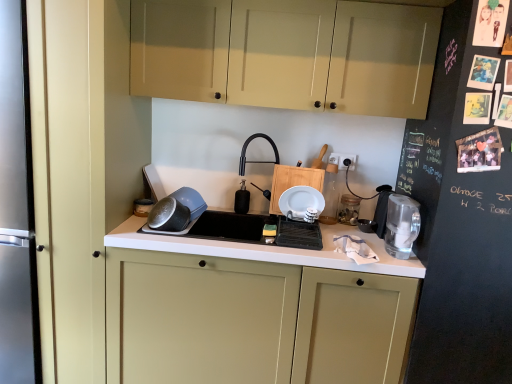
Where is `free spot to the right of black matte soap dispenser at center, marked as the second appliance in a left-to-right arrangement`? free spot to the right of black matte soap dispenser at center, marked as the second appliance in a left-to-right arrangement is located at coordinates (261, 214).